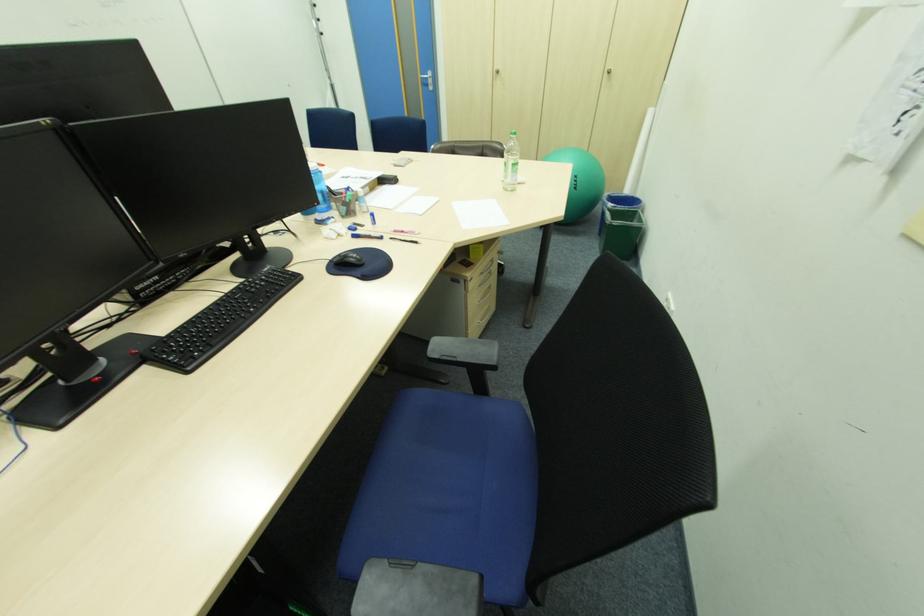
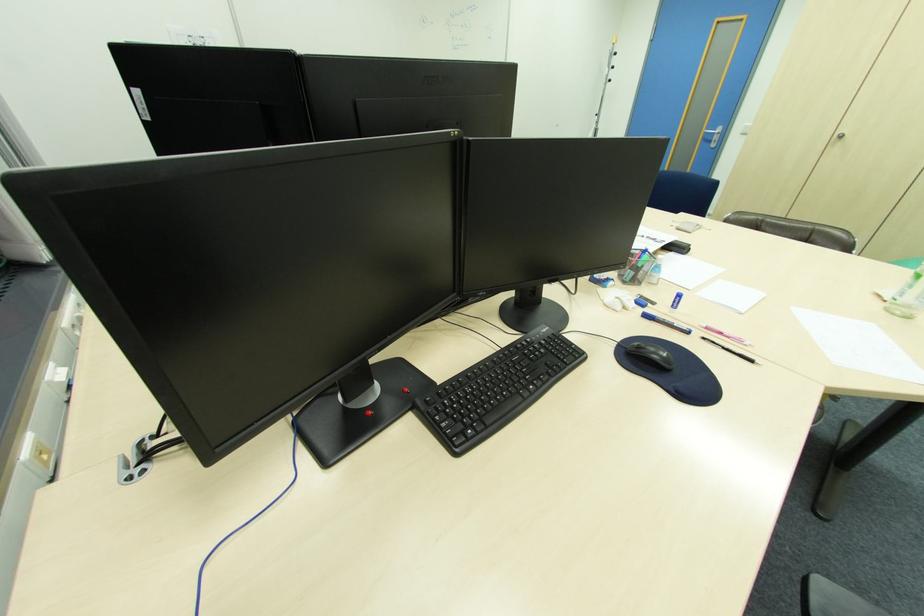
In the second image, find the point that corresponds to (360,237) in the first image.

(651, 315)